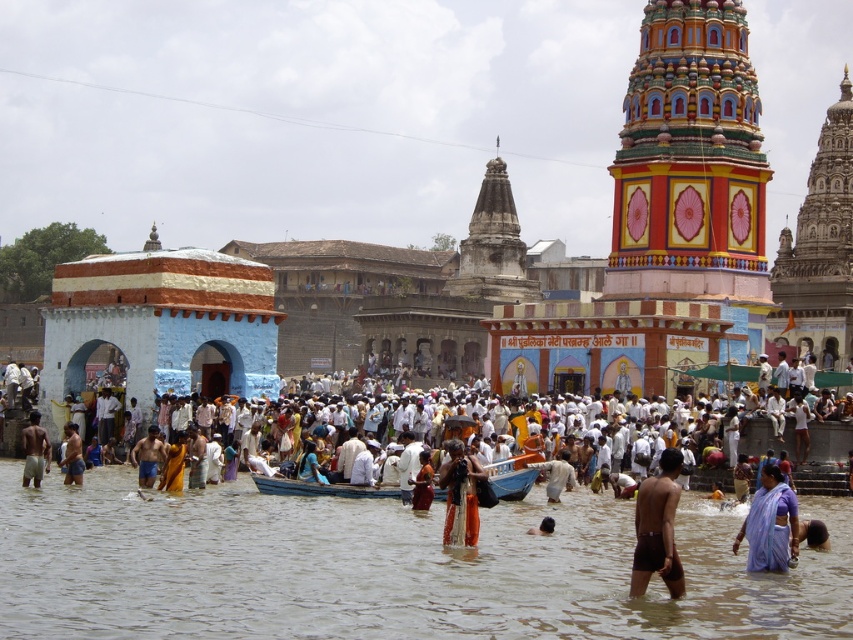
Question: Can you confirm if white clothed person at center is smaller than blue wooden boat at center?

Choices:
 (A) no
 (B) yes

Answer: (A)

Question: Considering the relative positions of brown matte shorts at lower center and blue wooden boat at center in the image provided, where is brown matte shorts at lower center located with respect to blue wooden boat at center?

Choices:
 (A) above
 (B) below

Answer: (A)

Question: Based on their relative distances, which object is farther from the white clothed person at center?

Choices:
 (A) matte orange shorts at center
 (B) brown skin at lower center
 (C) orange fabric cloth at lower left

Answer: (B)

Question: Does brown muddy water at center come in front of white clothed person at center?

Choices:
 (A) no
 (B) yes

Answer: (B)

Question: Which point is farther from the camera taking this photo?

Choices:
 (A) (813, 547)
 (B) (544, 468)
 (C) (653, 528)

Answer: (B)

Question: Among these objects, which one is nearest to the camera?

Choices:
 (A) brown matte shorts at lower center
 (B) brown skin at lower center
 (C) white clothed person at center

Answer: (A)